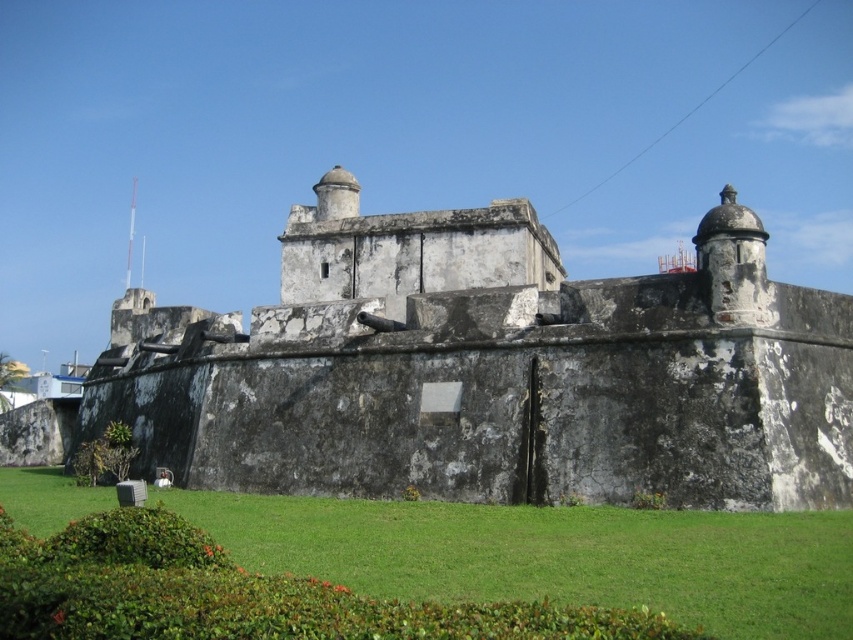
You are a historian examining the fortification. You notice a specific point marked at coordinates (492,372). Based on the scene, what does this point likely represent?

The point at coordinates (492,372) indicates the weathered stone wall at center, which is a central feature of the fortification.

From the picture: You are a tourist visiting the historic fortification. You want to take a photo of the weathered stone wall at center and the green grass at lower center. Which object should you focus on first if you want to capture both in a single frame without moving your camera?

The weathered stone wall at center is bigger than the green grass at lower center, so you should focus on the weathered stone wall at center first to ensure it fits properly in the frame before adjusting for the smaller green grass at lower center.